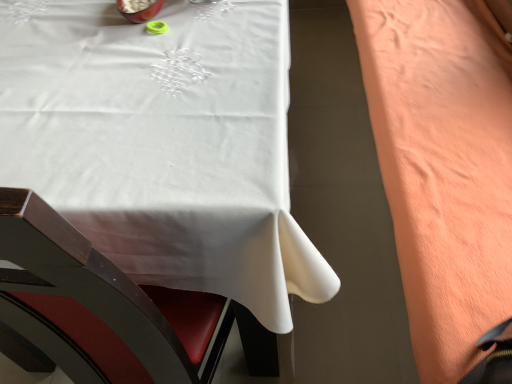
Question: Does white fabric table at upper left have a smaller size compared to coral fleece blanket at right?

Choices:
 (A) yes
 (B) no

Answer: (B)

Question: Considering the relative positions of white fabric table at upper left and coral fleece blanket at right in the image provided, is white fabric table at upper left in front of coral fleece blanket at right?

Choices:
 (A) yes
 (B) no

Answer: (A)

Question: Is white fabric table at upper left not close to coral fleece blanket at right?

Choices:
 (A) yes
 (B) no

Answer: (B)

Question: Is coral fleece blanket at right a part of white fabric table at upper left?

Choices:
 (A) yes
 (B) no

Answer: (B)

Question: Are white fabric table at upper left and coral fleece blanket at right beside each other?

Choices:
 (A) yes
 (B) no

Answer: (B)

Question: Can you confirm if white fabric table at upper left is bigger than coral fleece blanket at right?

Choices:
 (A) no
 (B) yes

Answer: (B)

Question: Can you confirm if coral fleece blanket at right is positioned to the right of white fabric table at upper left?

Choices:
 (A) no
 (B) yes

Answer: (B)

Question: From a real-world perspective, is coral fleece blanket at right positioned under white fabric table at upper left based on gravity?

Choices:
 (A) yes
 (B) no

Answer: (B)

Question: Does coral fleece blanket at right have a greater width compared to white fabric table at upper left?

Choices:
 (A) yes
 (B) no

Answer: (B)

Question: Is coral fleece blanket at right far from white fabric table at upper left?

Choices:
 (A) no
 (B) yes

Answer: (A)

Question: Is coral fleece blanket at right at the left side of white fabric table at upper left?

Choices:
 (A) yes
 (B) no

Answer: (B)

Question: Is white fabric table at upper left surrounded by coral fleece blanket at right?

Choices:
 (A) yes
 (B) no

Answer: (B)

Question: Is coral fleece blanket at right to the left or to the right of white fabric table at upper left in the image?

Choices:
 (A) right
 (B) left

Answer: (A)